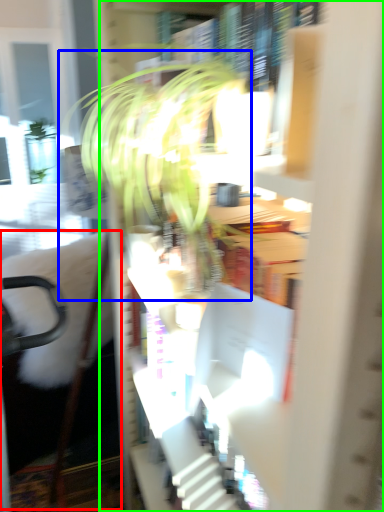
Question: Based on their relative distances, which object is nearer to swivel chair (highlighted by a red box)? Choose from houseplant (highlighted by a blue box) and bookcase (highlighted by a green box).

Choices:
 (A) houseplant
 (B) bookcase

Answer: (A)